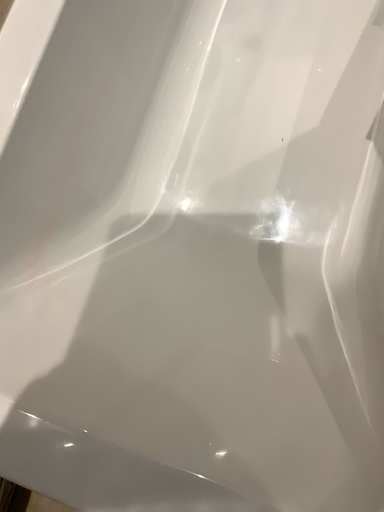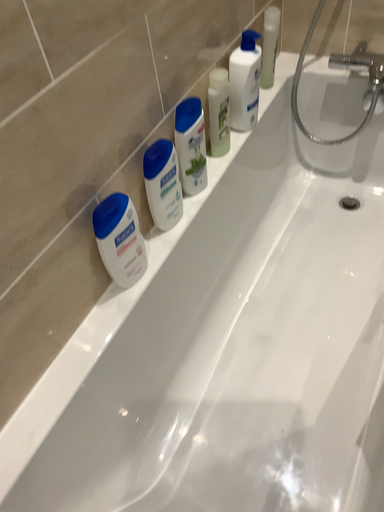
Question: How did the camera likely rotate when shooting the video?

Choices:
 (A) rotated downward
 (B) rotated upward

Answer: (B)